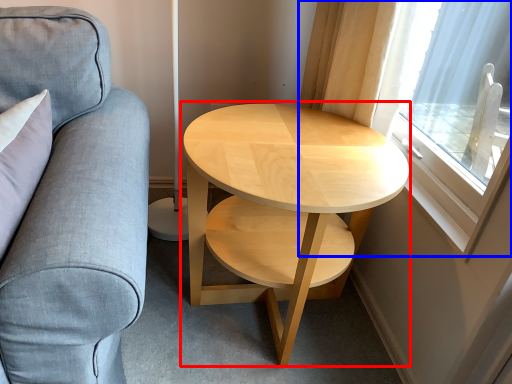
Question: Which object appears farthest to the camera in this image, coffee table (highlighted by a red box) or window (highlighted by a blue box)?

Choices:
 (A) coffee table
 (B) window

Answer: (A)